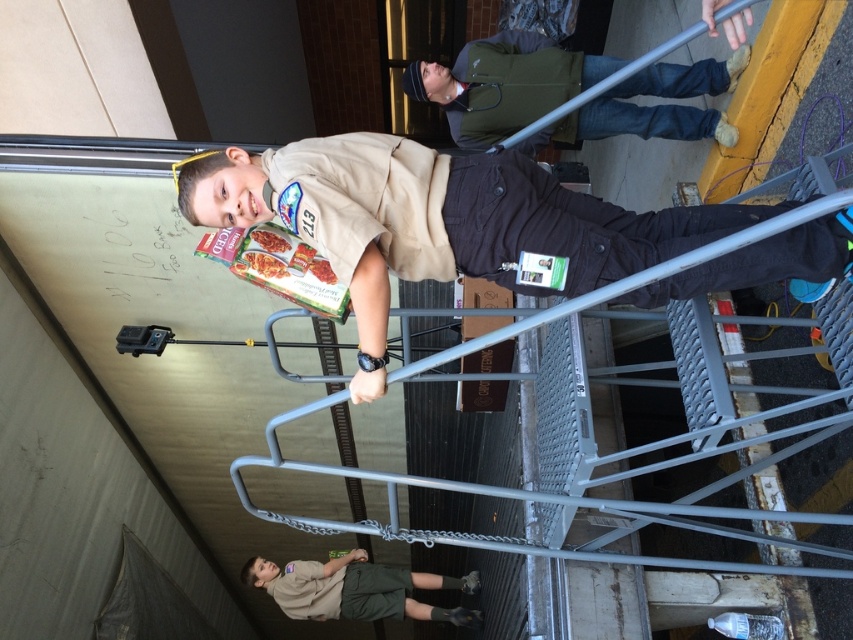
Question: Does matte brown uniform at center appear under green fabric jacket at upper center?

Choices:
 (A) yes
 (B) no

Answer: (A)

Question: Among these objects, which one is nearest to the camera?

Choices:
 (A) green fabric jacket at upper center
 (B) khaki uniform at center

Answer: (A)

Question: Among these points, which one is nearest to the camera?

Choices:
 (A) (343, 593)
 (B) (440, 241)

Answer: (B)

Question: Is green fabric jacket at upper center smaller than khaki uniform at center?

Choices:
 (A) no
 (B) yes

Answer: (A)

Question: Estimate the real-world distances between objects in this image. Which object is closer to the green fabric jacket at upper center?

Choices:
 (A) matte brown uniform at center
 (B) khaki uniform at center

Answer: (A)

Question: Does matte brown uniform at center appear on the right side of green fabric jacket at upper center?

Choices:
 (A) yes
 (B) no

Answer: (B)